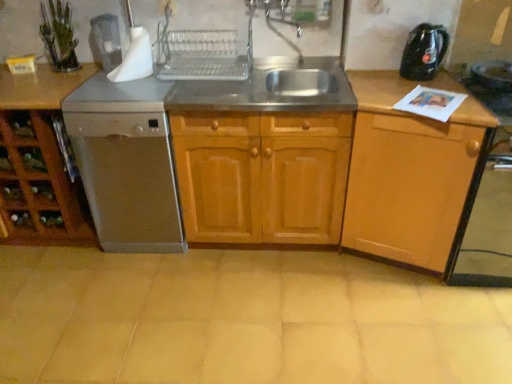
The width and height of the screenshot is (512, 384). What are the coordinates of `free space above beige ceramic tile at center (from a real-world perspective)` in the screenshot? It's located at (175, 301).